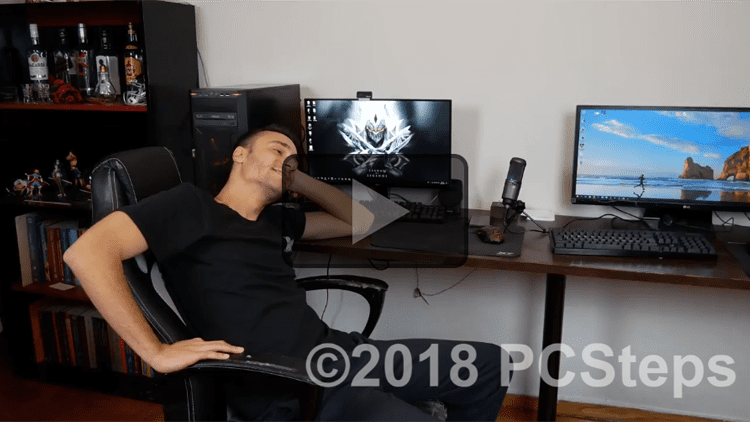
You are a GUI agent. You are given a task and a screenshot of the screen. Output one action in this format:
    pyautogui.click(x=<x>, y=<y>)
    Task: Click on the monitors
    Image resolution: width=750 pixels, height=422 pixels.
    Given the screenshot: What is the action you would take?
    pyautogui.click(x=679, y=140), pyautogui.click(x=398, y=115)